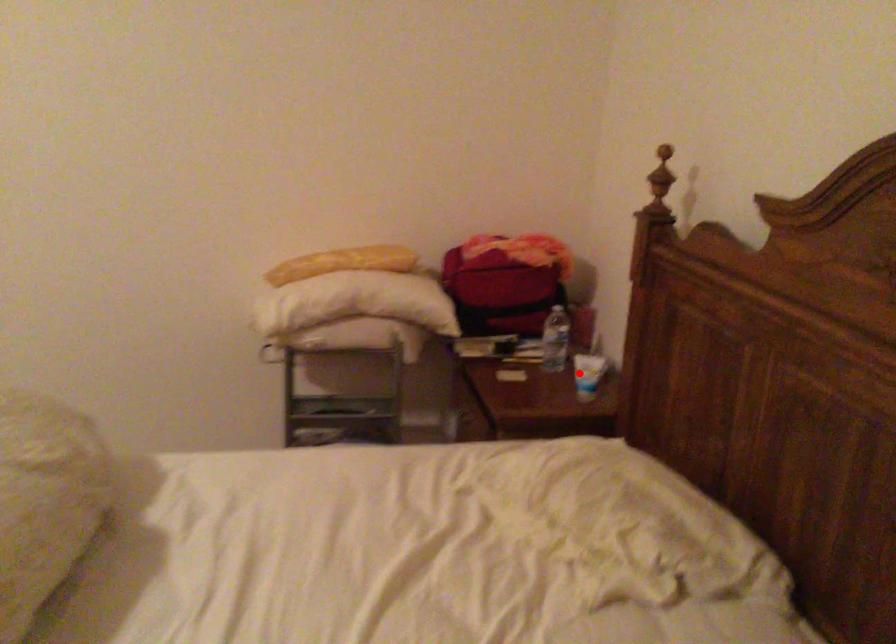
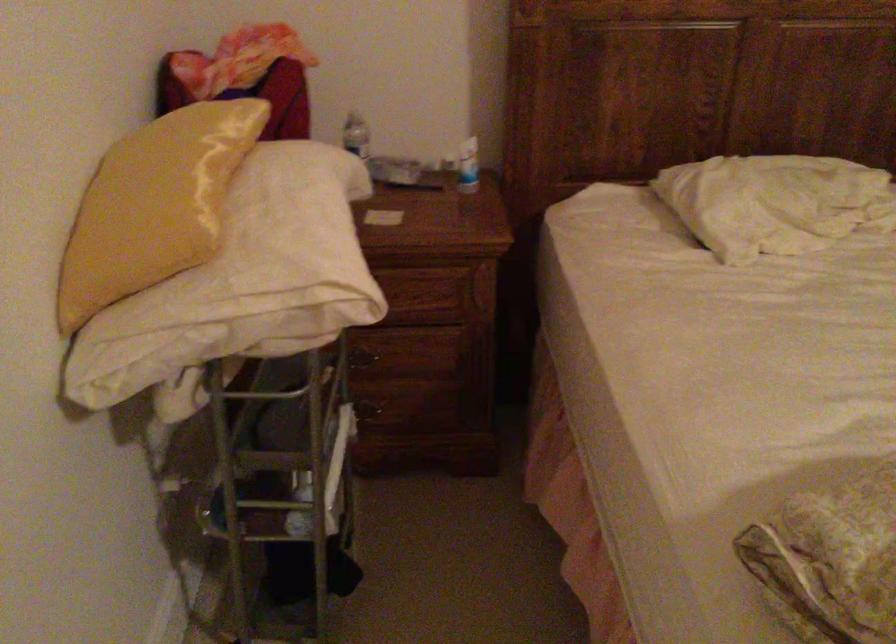
Locate, in the second image, the point that corresponds to the highlighted location in the first image.

(468, 166)